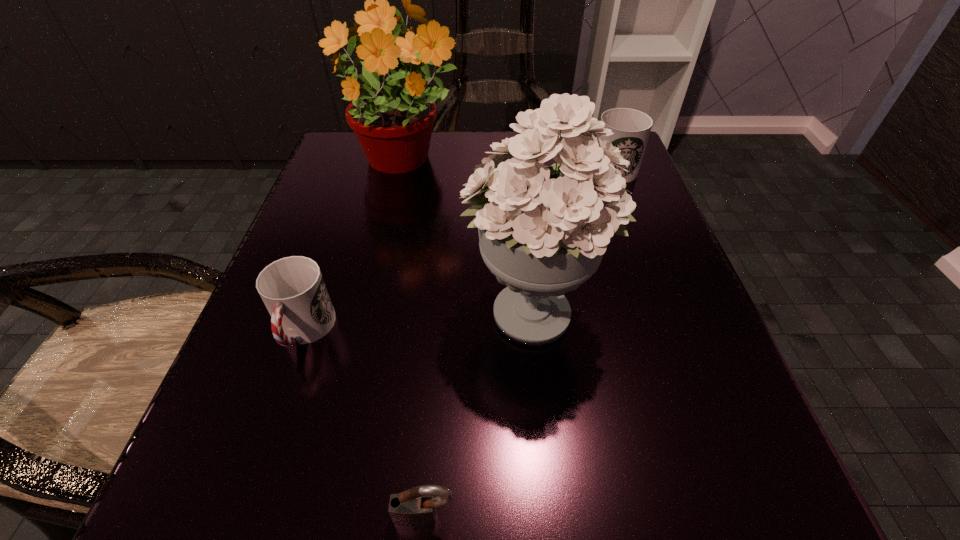
This screenshot has height=540, width=960. Identify the location of vacant space located 0.180m on the side of the rightmost object where the handle is located. (484, 170).

This screenshot has height=540, width=960. Identify the location of vacant position located 0.260m on the side of the rightmost object where the handle is located. (445, 170).

Locate an element on the screen. free spot located 0.110m on the handle side of the nearer cup is located at coordinates (264, 448).

This screenshot has height=540, width=960. I want to click on flowerpot situated at the far edge, so click(393, 125).

This screenshot has width=960, height=540. Find the location of `cup present at the far edge`. cup present at the far edge is located at coordinates (631, 128).

Locate an element on the screen. The height and width of the screenshot is (540, 960). object located in the near edge section of the desktop is located at coordinates (416, 507).

At what (x,y) coordinates should I click in order to perform the action: click on flowerpot that is at the left edge. Please return your answer as a coordinate pair (x, y). This screenshot has width=960, height=540. Looking at the image, I should click on (393, 125).

At what (x,y) coordinates should I click in order to perform the action: click on cup that is at the left edge. Please return your answer as a coordinate pair (x, y). Looking at the image, I should click on (293, 290).

Identify the location of bouquet present at the right edge. The image size is (960, 540). (543, 230).

The image size is (960, 540). Find the location of `cup situated at the right edge`. cup situated at the right edge is located at coordinates (631, 128).